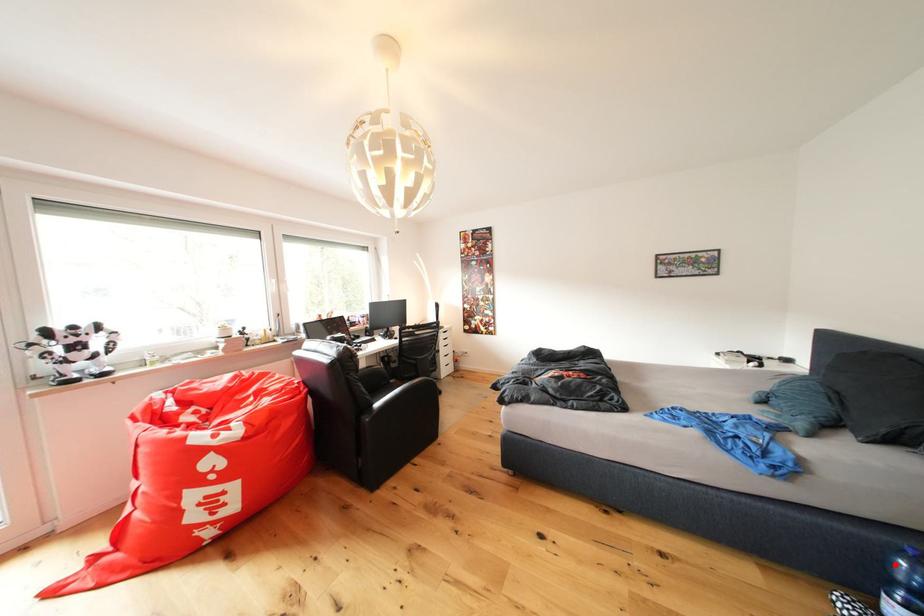
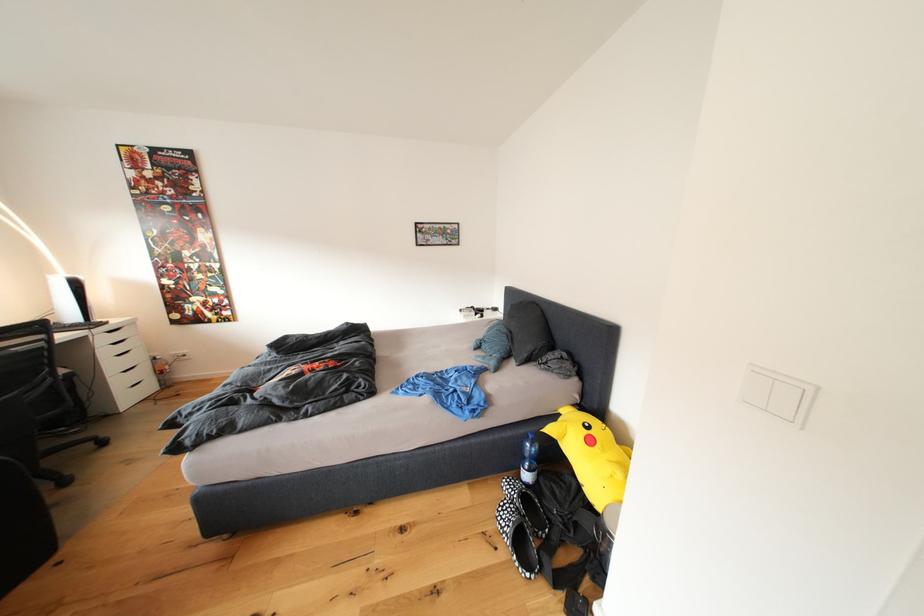
The point at the highlighted location is marked in the first image. Where is the corresponding point in the second image?

(531, 451)